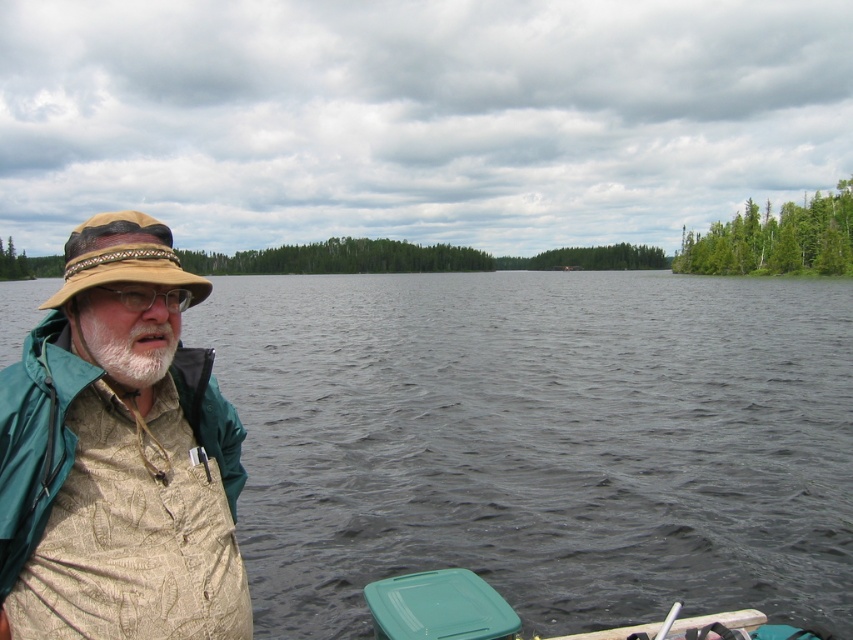
Does khaki fabric hat at left have a lesser width compared to tan woven hat at left?

Correct, khaki fabric hat at left's width is less than tan woven hat at left's.

Does point (198, 534) lie in front of point (96, 243)?

No.

Image resolution: width=853 pixels, height=640 pixels. Identify the location of khaki fabric hat at left. (119, 456).

From the picture: Can you confirm if khaki fabric hat at left is positioned to the left of whitewoollybeard at left?

Indeed, khaki fabric hat at left is positioned on the left side of whitewoollybeard at left.

Based on the photo, does khaki fabric hat at left appear over whitewoollybeard at left?

Indeed, khaki fabric hat at left is positioned over whitewoollybeard at left.

Does point (76, 259) lie behind point (142, 323)?

No, (76, 259) is in front of (142, 323).

At what (x,y) coordinates should I click in order to perform the action: click on khaki fabric hat at left. Please return your answer as a coordinate pair (x, y). Looking at the image, I should click on (119, 456).

Which is below, khaki fabric hat at left or green plastic cooler at lower center?

green plastic cooler at lower center is below.

Which of these two, khaki fabric hat at left or green plastic cooler at lower center, stands shorter?

Standing shorter between the two is green plastic cooler at lower center.

Describe the element at coordinates (119, 456) in the screenshot. This screenshot has height=640, width=853. I see `khaki fabric hat at left` at that location.

Find the location of `khaki fabric hat at left`. khaki fabric hat at left is located at coordinates (119, 456).